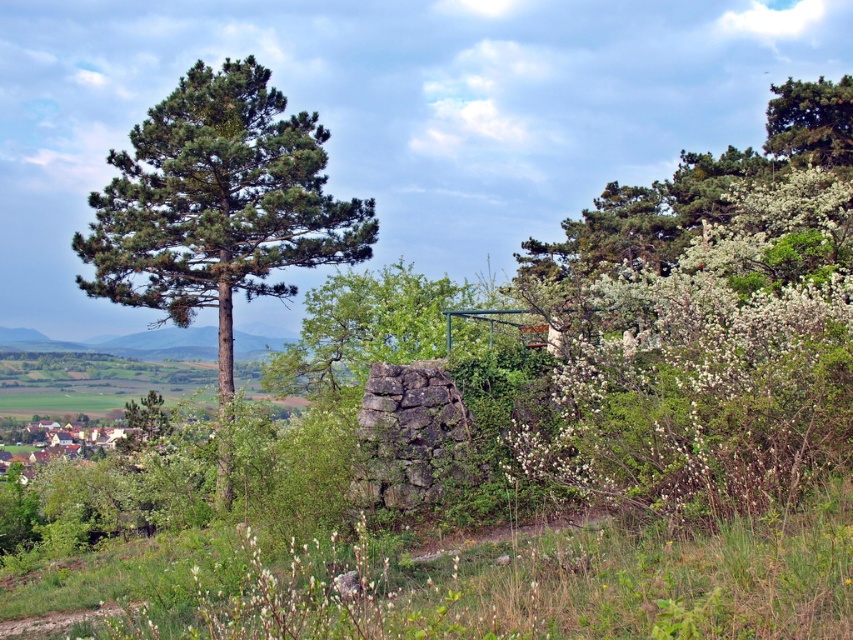
Based on the scene description, where is the green leafy tree at center located in terms of its 2D coordinates?

The green leafy tree at center is located at the 2D coordinates of point (367, 326).